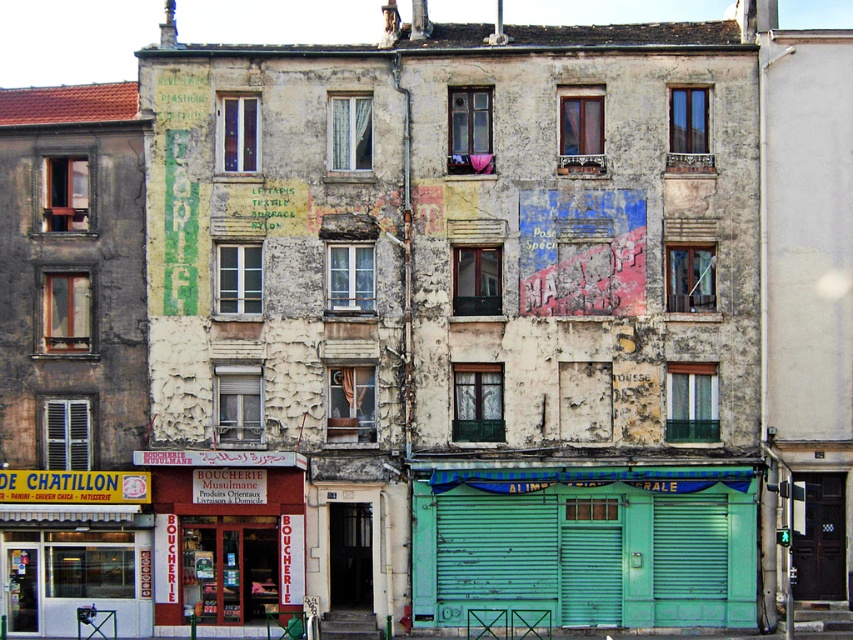
Question: Based on their relative distances, which object is farther from the red brick boucherie at lower left?

Choices:
 (A) green corrugated metal at center
 (B) teal metal/green at lower center
 (C) wooden shutter at left
 (D) green metallic shutter at lower center

Answer: (D)

Question: Can you confirm if green corrugated metal at center is positioned to the left of green metallic shutter at lower center?

Choices:
 (A) no
 (B) yes

Answer: (B)

Question: Is the position of red brick boucherie at lower left less distant than that of green metallic shutter at lower center?

Choices:
 (A) no
 (B) yes

Answer: (B)

Question: Does teal metal/green at lower center appear on the right side of wooden shutter at left?

Choices:
 (A) no
 (B) yes

Answer: (B)

Question: Which point is closer to the camera?

Choices:
 (A) teal metal/green at lower center
 (B) green metallic shutter at lower center
 (C) red brick boucherie at lower left

Answer: (A)

Question: Which point is farther from the camera taking this photo?

Choices:
 (A) (80, 444)
 (B) (612, 540)
 (C) (527, 564)
 (D) (668, 534)

Answer: (A)